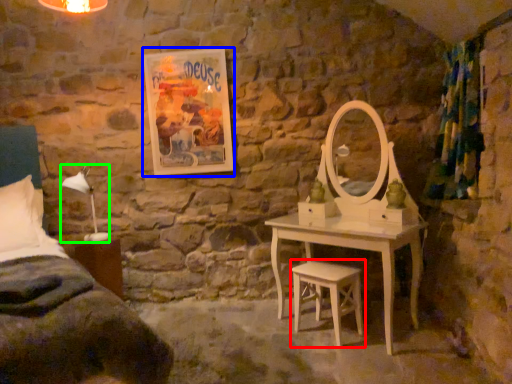
Question: Based on their relative distances, which object is farther from stool (highlighted by a red box)? Choose from picture frame (highlighted by a blue box) and table lamp (highlighted by a green box).

Choices:
 (A) picture frame
 (B) table lamp

Answer: (B)